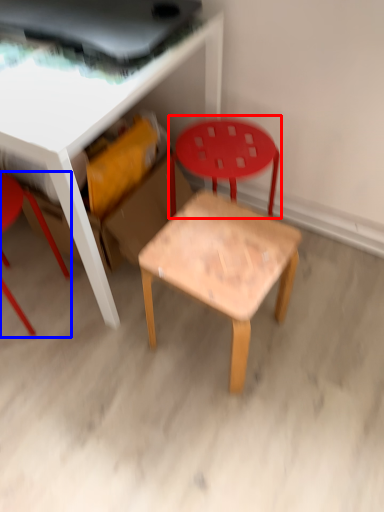
Question: Which object is closer to the camera taking this photo, chair (highlighted by a red box) or chair (highlighted by a blue box)?

Choices:
 (A) chair
 (B) chair

Answer: (B)